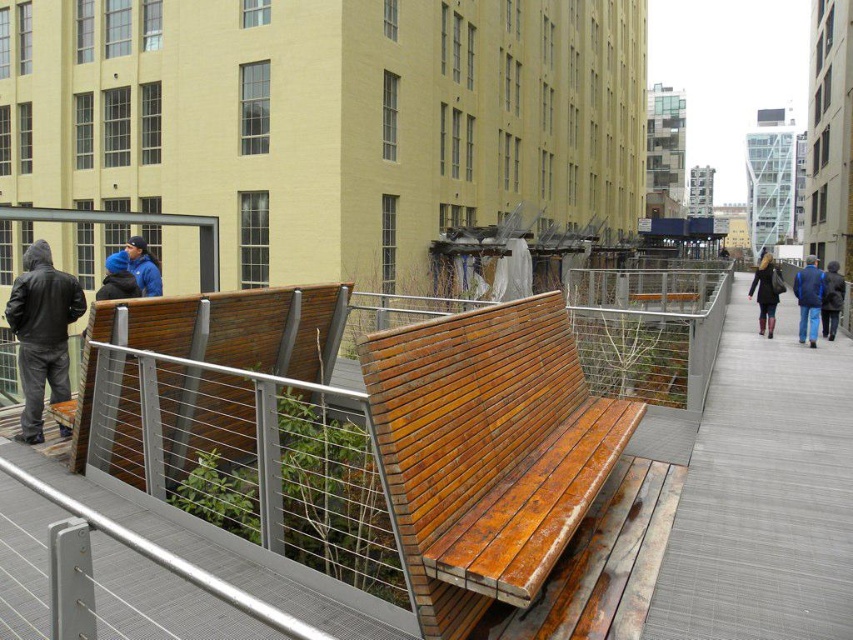
Question: Can you confirm if matte black coat at center right is positioned to the left of dark brown leather jacket at right?

Choices:
 (A) no
 (B) yes

Answer: (A)

Question: Observing the image, what is the correct spatial positioning of dark gray hoodie at left in reference to matte black coat at center right?

Choices:
 (A) left
 (B) right

Answer: (A)

Question: Which is farther from the gray textured pavement at center?

Choices:
 (A) dark gray hoodie at left
 (B) matte black coat at center right
 (C) rustic wood bench at center

Answer: (A)

Question: Which of the following is the closest to the observer?

Choices:
 (A) matte black coat at center right
 (B) dark gray hoodie at left
 (C) matte blue jacket at left

Answer: (B)

Question: Can you confirm if blue denim jacket at lower right is positioned above blue jacket at left?

Choices:
 (A) yes
 (B) no

Answer: (A)

Question: Which is nearer to the matte blue jacket at left?

Choices:
 (A) dark brown leather jacket at right
 (B) dark gray hoodie at left
 (C) rustic wood bench at center

Answer: (B)